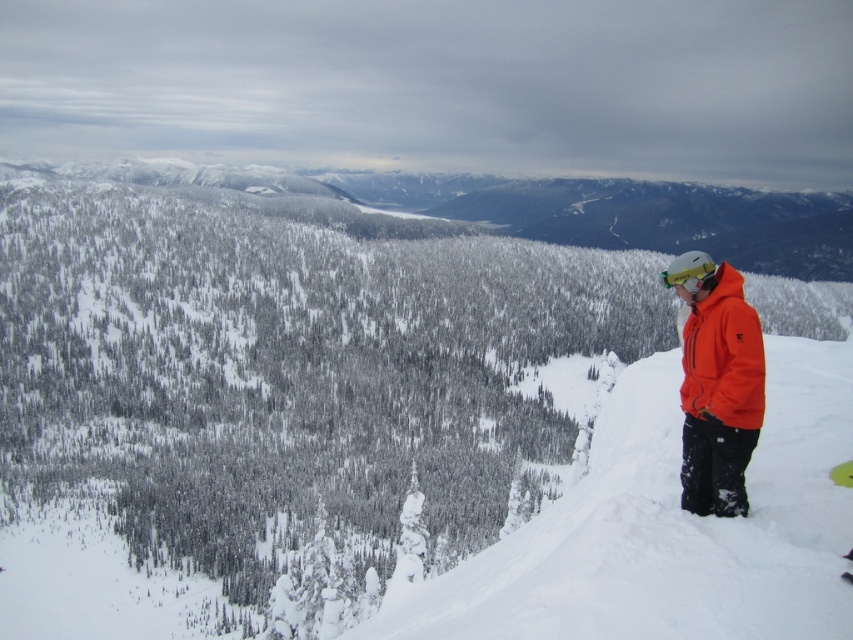
Can you confirm if orange softshell jacket at right is thinner than matte yellow goggles at right?

No, orange softshell jacket at right is not thinner than matte yellow goggles at right.

Does orange softshell jacket at right appear over matte yellow goggles at right?

Actually, orange softshell jacket at right is below matte yellow goggles at right.

Measure the distance between point [704,355] and camera.

Point [704,355] is 76.83 feet from camera.

You are a GUI agent. You are given a task and a screenshot of the screen. Output one action in this format:
    pyautogui.click(x=<x>, y=<y>)
    Task: Click on the orange softshell jacket at right
    Image resolution: width=853 pixels, height=640 pixels.
    Given the screenshot: What is the action you would take?
    coord(723,355)

Who is positioned more to the left, white fluffy snow at upper right or orange softshell jacket at right?

orange softshell jacket at right is more to the left.

Between point (685, 580) and point (692, 321), which one is positioned in front?

Positioned in front is point (685, 580).

In order to click on white fluffy snow at upper right in this screenshot , I will do `click(366, 419)`.

This screenshot has height=640, width=853. I want to click on white snow ski slope at right, so click(668, 528).

This screenshot has height=640, width=853. In order to click on white snow ski slope at right in this screenshot , I will do `click(668, 528)`.